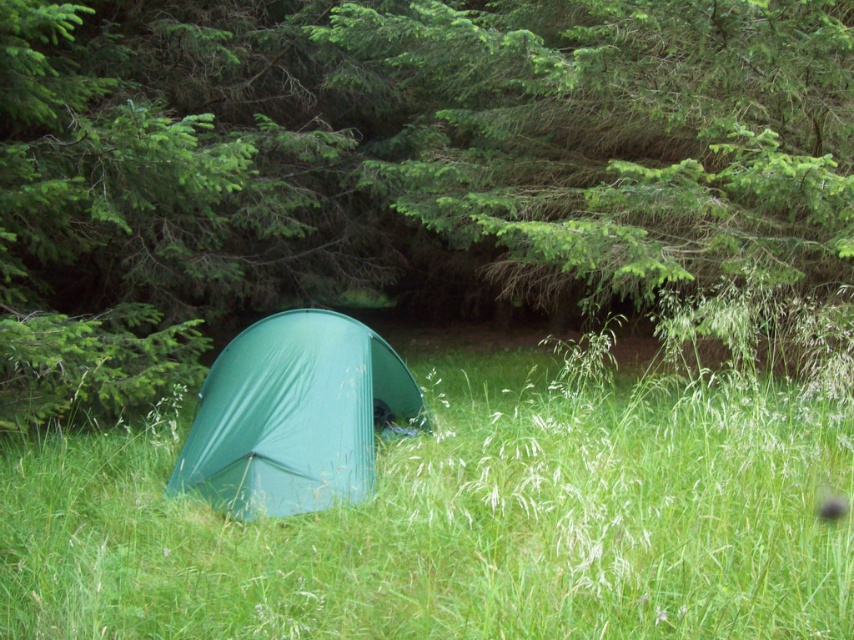
Question: Which is nearer to the green fabric tent at center?

Choices:
 (A) green matte tent at center
 (B) green tarpaulin tent at center

Answer: (B)

Question: Which of the following is the closest to the observer?

Choices:
 (A) green matte tent at center
 (B) green tarpaulin tent at center

Answer: (A)

Question: Which of the following is the closest to the observer?

Choices:
 (A) green matte tent at center
 (B) green tarpaulin tent at center
 (C) green fabric tent at center

Answer: (C)

Question: Does green matte tent at center have a lesser width compared to green tarpaulin tent at center?

Choices:
 (A) yes
 (B) no

Answer: (B)

Question: Is green fabric tent at center to the left of green tarpaulin tent at center from the viewer's perspective?

Choices:
 (A) no
 (B) yes

Answer: (A)

Question: Can you confirm if green matte tent at center is positioned below green tarpaulin tent at center?

Choices:
 (A) yes
 (B) no

Answer: (B)